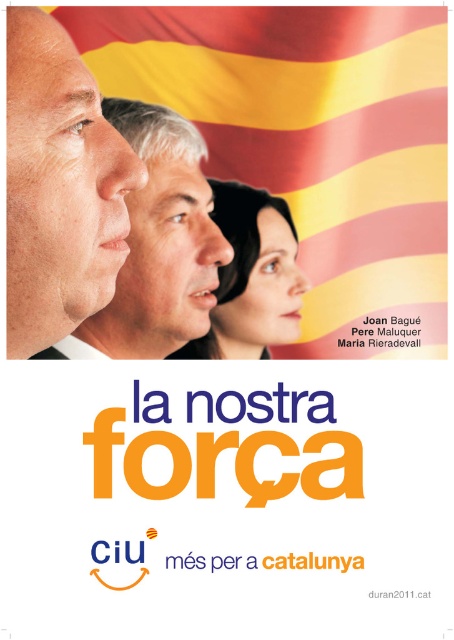
Looking at the political campaign poster for CiU, you notice two faces labeled as smooth skin face at upper left and smooth skin face at upper center. Which of these two faces has a smaller width?

The smooth skin face at upper left has a smaller width than the smooth skin face at upper center.